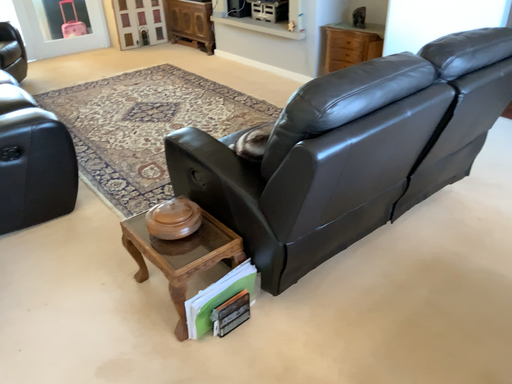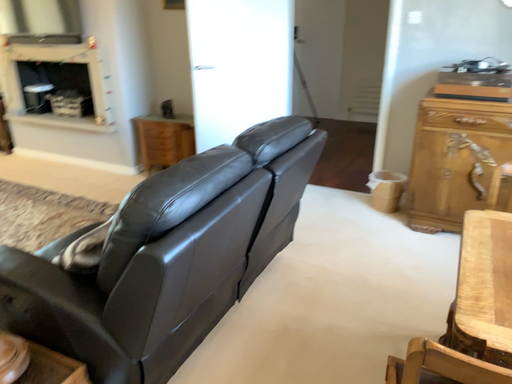
Question: How did the camera likely rotate when shooting the video?

Choices:
 (A) rotated left
 (B) rotated right

Answer: (B)